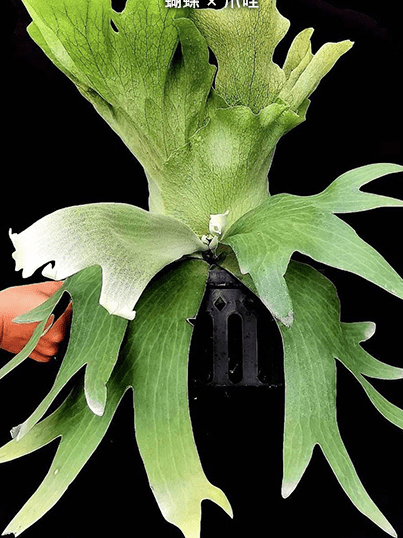
Locate an element on the screen. black areas of design on gray pot is located at coordinates (236, 325), (265, 346), (237, 372), (207, 330), (208, 360).